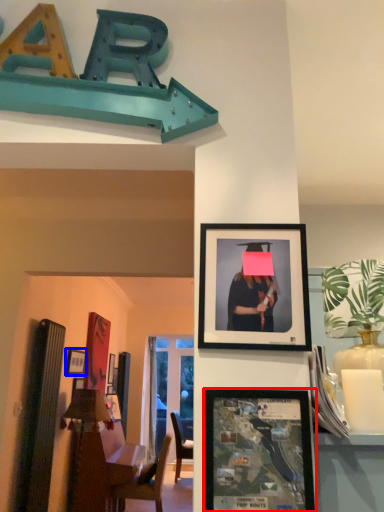
Question: Which point is further to the camera, picture frame (highlighted by a red box) or picture frame (highlighted by a blue box)?

Choices:
 (A) picture frame
 (B) picture frame

Answer: (B)